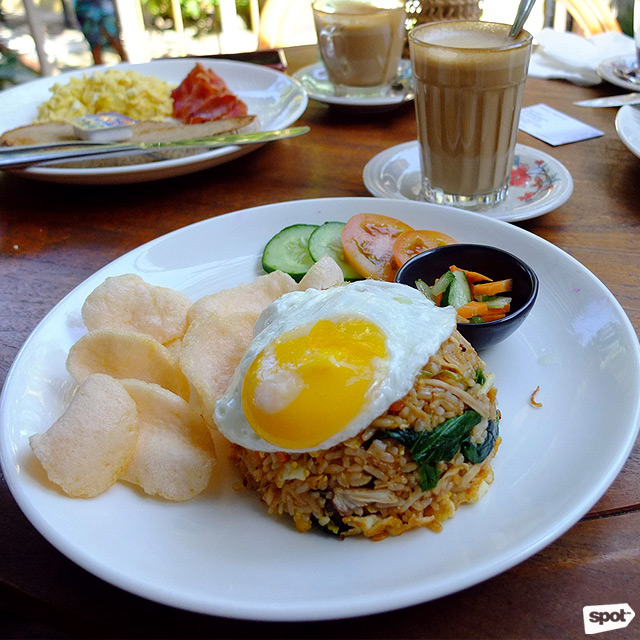
You are a GUI agent. You are given a task and a screenshot of the screen. Output one action in this format:
    pyautogui.click(x=<x>, y=<y>)
    Task: Click on the table
    
    Given the screenshot: What is the action you would take?
    pyautogui.click(x=634, y=216), pyautogui.click(x=268, y=175), pyautogui.click(x=66, y=230), pyautogui.click(x=43, y=265), pyautogui.click(x=332, y=120), pyautogui.click(x=552, y=92), pyautogui.click(x=611, y=543)